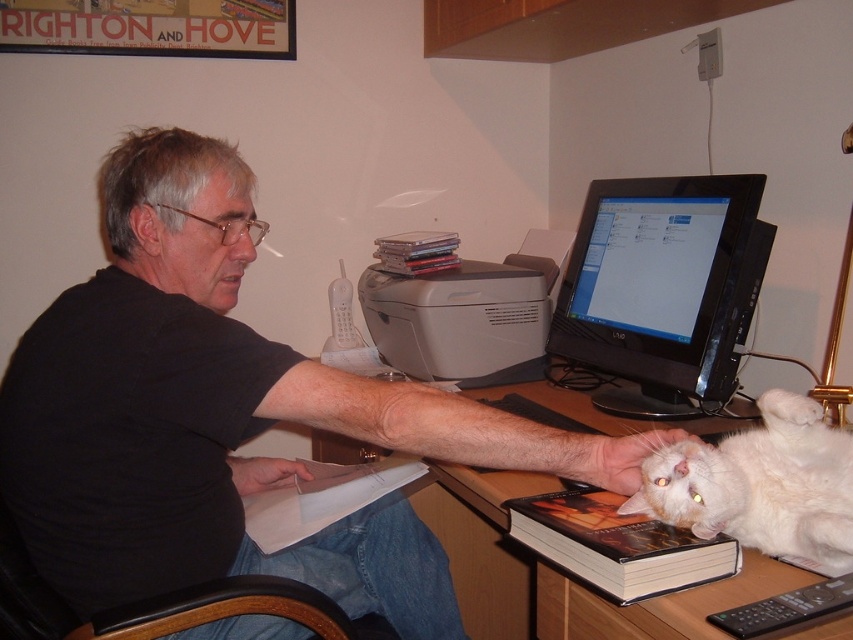
What are the coordinates of the black matte shirt at upper left?

The coordinates of the black matte shirt at upper left are at point (225, 416).

You are a delivery person who needs to place a small package on the desk. The package must be placed on an object that is not covered by anything else. Which object between the white fluffy cat at lower right and the hardcover book at lower right can you use?

The hardcover book at lower right is not covered by anything else since the white fluffy cat at lower right is positioned over it, so you can place the package on the hardcover book at lower right.